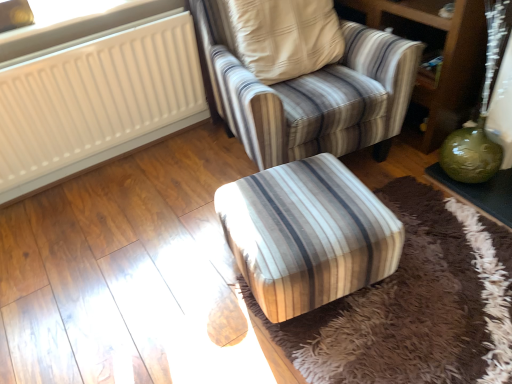
Question: From a real-world perspective, is green glass vase at right positioned under striped fabric armchair at center based on gravity?

Choices:
 (A) yes
 (B) no

Answer: (A)

Question: Are green glass vase at right and striped fabric armchair at center located far from each other?

Choices:
 (A) no
 (B) yes

Answer: (A)

Question: Considering the relative sizes of green glass vase at right and striped fabric armchair at center in the image provided, is green glass vase at right taller than striped fabric armchair at center?

Choices:
 (A) yes
 (B) no

Answer: (B)

Question: Is green glass vase at right shorter than striped fabric armchair at center?

Choices:
 (A) yes
 (B) no

Answer: (A)

Question: Considering the relative sizes of green glass vase at right and striped fabric armchair at center in the image provided, is green glass vase at right smaller than striped fabric armchair at center?

Choices:
 (A) no
 (B) yes

Answer: (B)

Question: Can you confirm if green glass vase at right is bigger than striped fabric armchair at center?

Choices:
 (A) yes
 (B) no

Answer: (B)

Question: From the image's perspective, is white matte radiator at upper left on top of green glossy vase at lower right?

Choices:
 (A) yes
 (B) no

Answer: (B)

Question: From a real-world perspective, is white matte radiator at upper left positioned over green glossy vase at lower right based on gravity?

Choices:
 (A) no
 (B) yes

Answer: (B)

Question: Is white matte radiator at upper left positioned in front of green glossy vase at lower right?

Choices:
 (A) no
 (B) yes

Answer: (B)

Question: Does white matte radiator at upper left appear on the left side of green glossy vase at lower right?

Choices:
 (A) no
 (B) yes

Answer: (B)

Question: Can you confirm if white matte radiator at upper left is thinner than green glossy vase at lower right?

Choices:
 (A) yes
 (B) no

Answer: (A)

Question: Is white matte radiator at upper left aimed at green glossy vase at lower right?

Choices:
 (A) no
 (B) yes

Answer: (A)

Question: Does white plastic radiator at upper left come in front of green glossy vase at lower right?

Choices:
 (A) no
 (B) yes

Answer: (A)